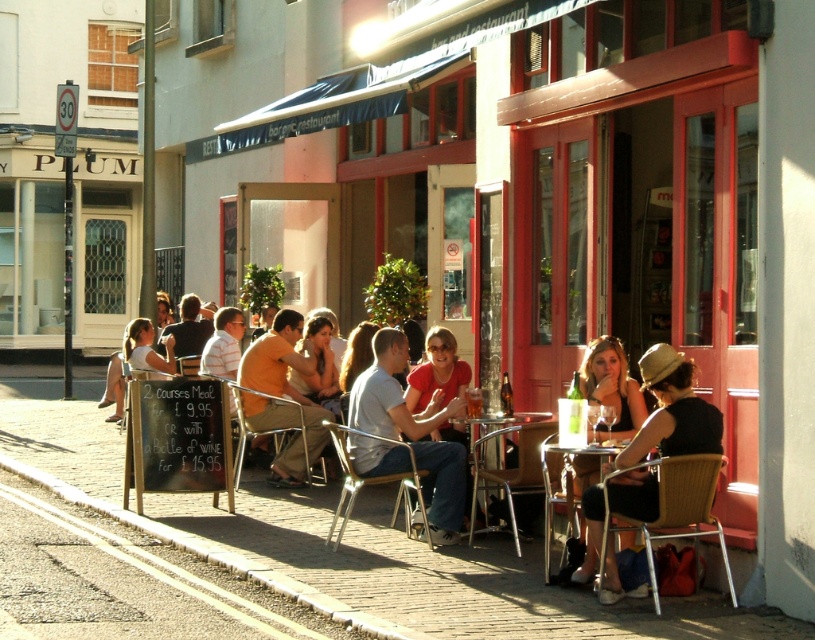
Does metallic silver table at lower center have a larger size compared to wooden table at lower right?

Actually, metallic silver table at lower center might be smaller than wooden table at lower right.

Which is more to the right, metallic silver table at lower center or wooden table at lower right?

wooden table at lower right

Is point (534, 460) positioned after point (545, 467)?

Yes, point (534, 460) is farther from viewer.

Locate an element on the screen. metallic silver table at lower center is located at coordinates (509, 472).

Which of these two, matte orange shirt at center or matte black dress at lower right, stands shorter?

With less height is matte black dress at lower right.

Which is more to the right, matte orange shirt at center or matte black dress at lower right?

matte black dress at lower right is more to the right.

Image resolution: width=815 pixels, height=640 pixels. What do you see at coordinates (412, 432) in the screenshot? I see `matte orange shirt at center` at bounding box center [412, 432].

What are the coordinates of `matte orange shirt at center` in the screenshot? It's located at (412, 432).

Does matte black dress at lower right appear on the left side of metallic silver table at lower center?

In fact, matte black dress at lower right is to the right of metallic silver table at lower center.

Which is in front, point (622, 499) or point (529, 420)?

Point (622, 499) is in front.

Identify the location of matte black dress at lower right. Image resolution: width=815 pixels, height=640 pixels. (672, 412).